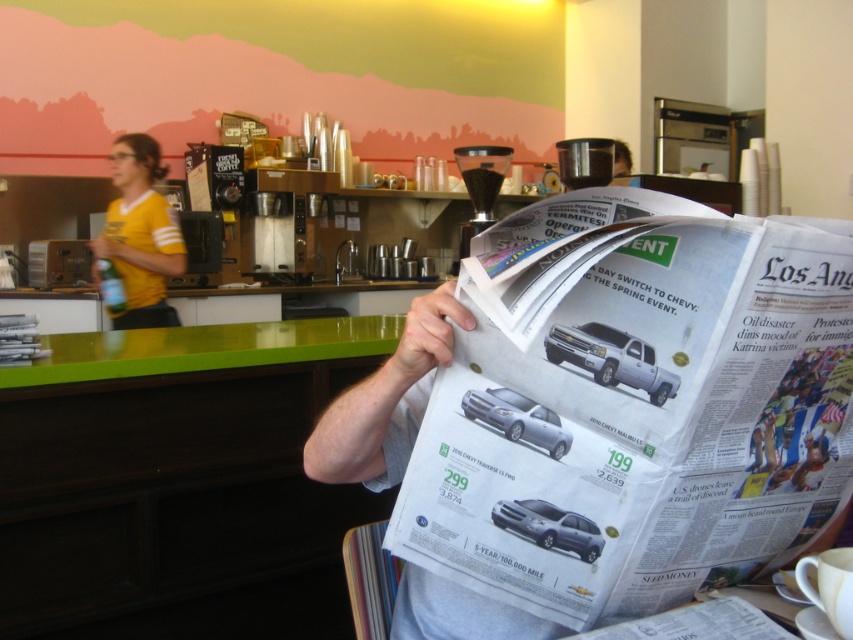
Question: Which point is farther to the camera?

Choices:
 (A) white glossy newspaper at center
 (B) metallic silver coffee machine at center

Answer: (B)

Question: Does white glossy newspaper at center have a lesser width compared to yellow jersey at left?

Choices:
 (A) no
 (B) yes

Answer: (A)

Question: Which point appears farthest from the camera in this image?

Choices:
 (A) (459, 163)
 (B) (619, 616)
 (C) (115, 157)

Answer: (C)

Question: Can you confirm if yellow jersey at left is wider than metallic silver coffee machine at center?

Choices:
 (A) no
 (B) yes

Answer: (B)

Question: Is white glossy newspaper at center bigger than matte black newspaper at center?

Choices:
 (A) yes
 (B) no

Answer: (A)

Question: Which object is positioned farthest from the yellow jersey at left?

Choices:
 (A) matte black newspaper at center
 (B) white glossy newspaper at center
 (C) metallic silver coffee machine at center

Answer: (B)